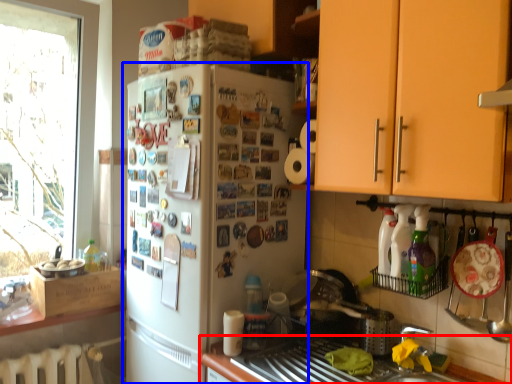
Question: Among these objects, which one is farthest to the camera, countertop (highlighted by a red box) or refrigerator (highlighted by a blue box)?

Choices:
 (A) countertop
 (B) refrigerator

Answer: (B)